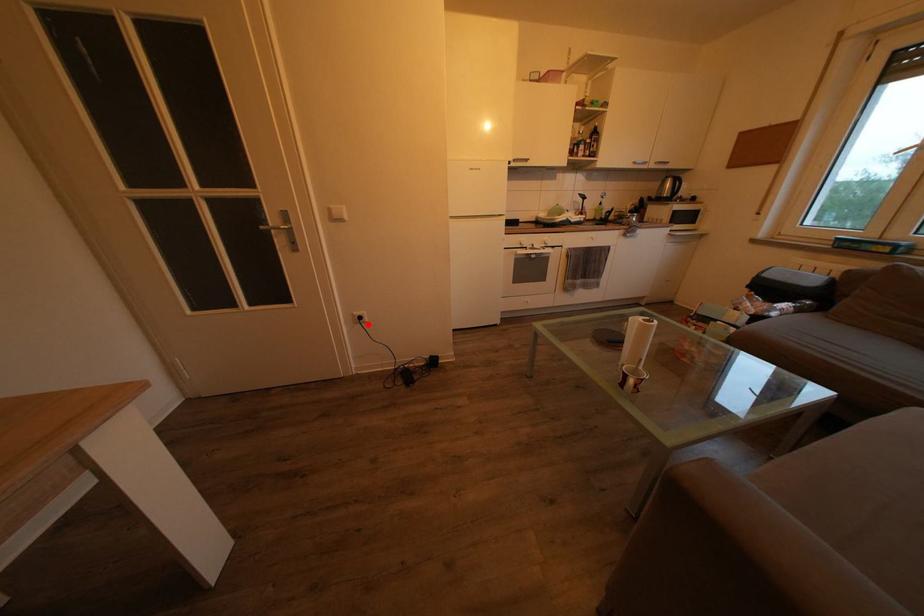
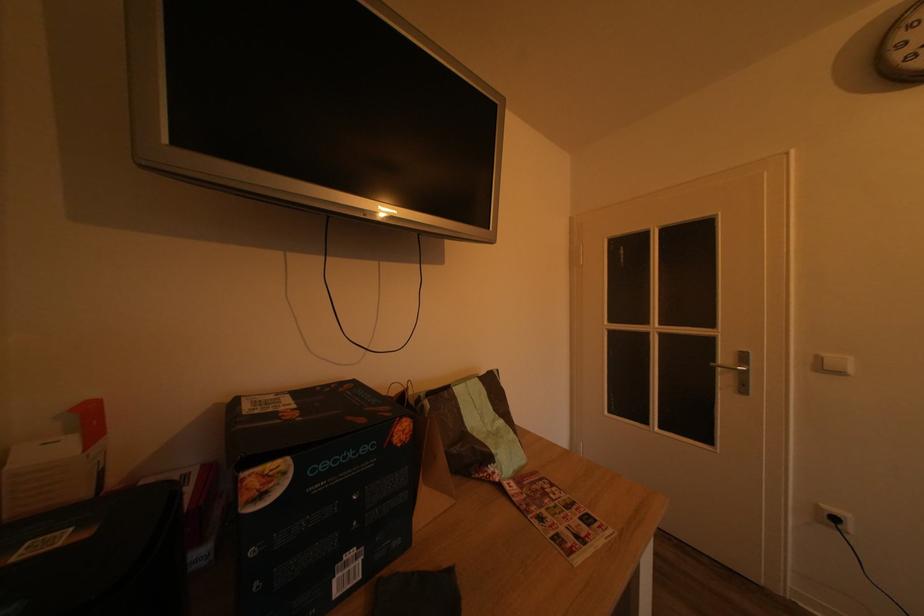
Locate, in the second image, the point that corresponds to the highlighted location in the first image.

(843, 525)